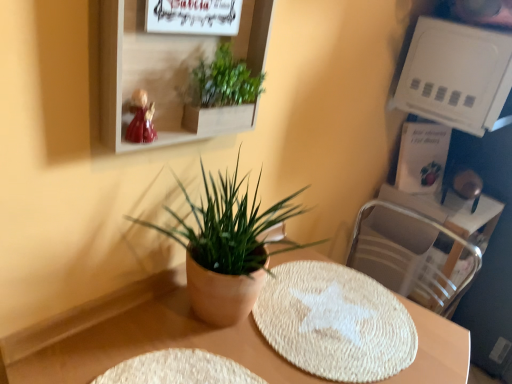
Question: Considering the relative sizes of matte white shelf at upper center, placed as the second shelf when sorted from right to left, and metallic silver swivel chair at right in the image provided, is matte white shelf at upper center, placed as the second shelf when sorted from right to left, thinner than metallic silver swivel chair at right?

Choices:
 (A) yes
 (B) no

Answer: (A)

Question: Is matte white shelf at upper center, placed as the second shelf when sorted from right to left, looking in the opposite direction of metallic silver swivel chair at right?

Choices:
 (A) no
 (B) yes

Answer: (A)

Question: Is matte white shelf at upper center, placed as the second shelf when sorted from right to left, at the right side of metallic silver swivel chair at right?

Choices:
 (A) no
 (B) yes

Answer: (A)

Question: From the image's perspective, is matte white shelf at upper center, which appears as the second shelf when viewed from the back, over metallic silver swivel chair at right?

Choices:
 (A) yes
 (B) no

Answer: (A)

Question: Is matte white shelf at upper center, placed as the second shelf when sorted from right to left, wider than metallic silver swivel chair at right?

Choices:
 (A) no
 (B) yes

Answer: (A)

Question: Is matte white shelf at upper center, the first shelf when ordered from left to right, closer to camera compared to metallic silver swivel chair at right?

Choices:
 (A) yes
 (B) no

Answer: (A)

Question: Is green leafy plant at upper center, which appears as the 2th houseplant when ordered from the bottom, closer to camera compared to metallic silver swivel chair at right?

Choices:
 (A) no
 (B) yes

Answer: (B)

Question: Considering the relative sizes of green leafy plant at upper center, which appears as the 2th houseplant when ordered from the bottom, and metallic silver swivel chair at right in the image provided, is green leafy plant at upper center, which appears as the 2th houseplant when ordered from the bottom, taller than metallic silver swivel chair at right?

Choices:
 (A) yes
 (B) no

Answer: (B)

Question: Is the depth of green leafy plant at upper center, which appears as the 2th houseplant when ordered from the bottom, greater than that of metallic silver swivel chair at right?

Choices:
 (A) no
 (B) yes

Answer: (A)

Question: Considering the relative sizes of green leafy plant at upper center, which appears as the 1th houseplant when viewed from the top, and metallic silver swivel chair at right in the image provided, is green leafy plant at upper center, which appears as the 1th houseplant when viewed from the top, thinner than metallic silver swivel chair at right?

Choices:
 (A) no
 (B) yes

Answer: (B)

Question: Could you tell me if green leafy plant at upper center, which appears as the 1th houseplant when viewed from the top, is turned towards metallic silver swivel chair at right?

Choices:
 (A) no
 (B) yes

Answer: (A)

Question: Does green leafy plant at upper center, which appears as the 1th houseplant when viewed from the top, have a smaller size compared to metallic silver swivel chair at right?

Choices:
 (A) no
 (B) yes

Answer: (B)

Question: Does white plastic shelf at upper right, which ranks as the 2th shelf in front-to-back order, have a lesser width compared to matte white shelf at upper center, the first shelf when ordered from left to right?

Choices:
 (A) no
 (B) yes

Answer: (A)